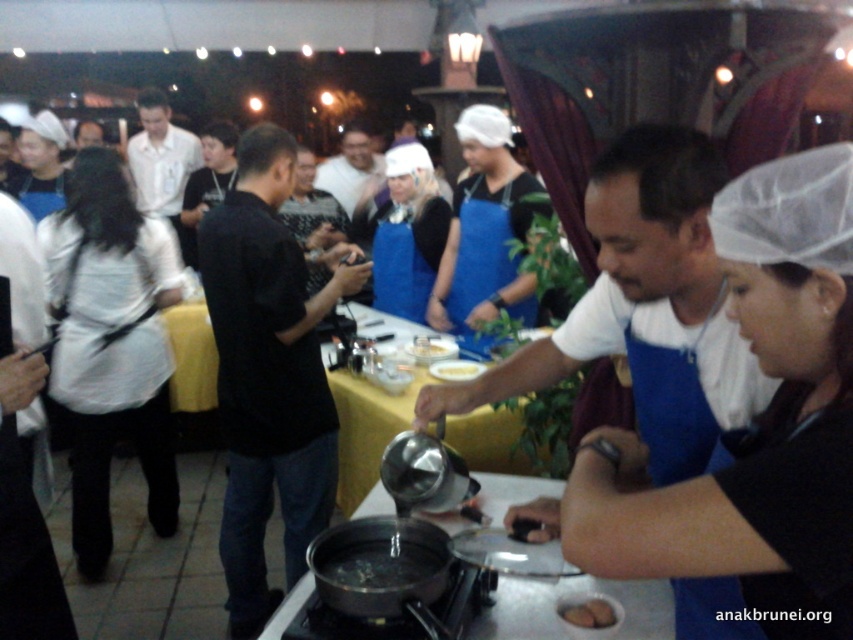
Question: Can you confirm if black matte shirt at center is positioned below white matte shirt at center?

Choices:
 (A) no
 (B) yes

Answer: (B)

Question: Estimate the real-world distances between objects in this image. Which object is closer to the blue fabric apron at center?

Choices:
 (A) matte black shirt at center
 (B) white matte shirt at center
 (C) yellow matte plate at center

Answer: (C)

Question: Is black matte shirt at center positioned before white matte shirt at center?

Choices:
 (A) no
 (B) yes

Answer: (B)

Question: Which point is farther to the camera?

Choices:
 (A) brown matte potato at center
 (B) white matte shirt at center

Answer: (B)

Question: Can you confirm if brown matte potato at center is positioned to the left of yellow matte plate at center?

Choices:
 (A) no
 (B) yes

Answer: (A)

Question: Among these points, which one is nearest to the camera?

Choices:
 (A) (601, 612)
 (B) (643, 317)
 (C) (431, 365)
 (D) (144, 92)

Answer: (A)